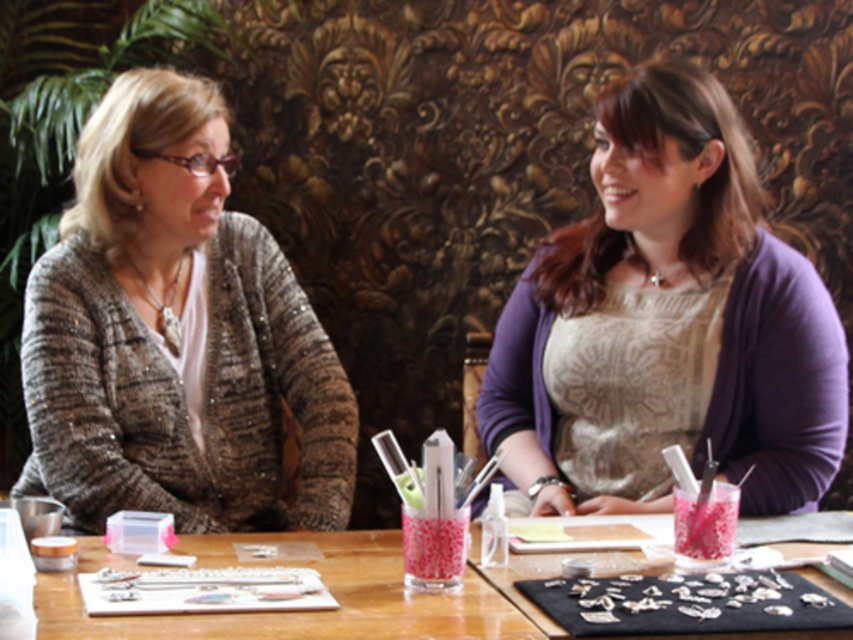
Between point (247, 275) and point (227, 545), which one is positioned behind?

The point (247, 275) is behind.

Image resolution: width=853 pixels, height=640 pixels. Describe the element at coordinates (173, 336) in the screenshot. I see `sparkly gray cardigan at left` at that location.

What are the coordinates of `sparkly gray cardigan at left` in the screenshot? It's located at (173, 336).

Locate an element on the screen. purple textured sweater at center is located at coordinates (666, 321).

Is point (584, 474) less distant than point (117, 225)?

No, (584, 474) is further to viewer.

Image resolution: width=853 pixels, height=640 pixels. I want to click on purple textured sweater at center, so click(x=666, y=321).

Is purple textured sweater at center to the left of wooden table at center from the viewer's perspective?

No, purple textured sweater at center is not to the left of wooden table at center.

Looking at this image, can you confirm if purple textured sweater at center is bigger than wooden table at center?

Correct, purple textured sweater at center is larger in size than wooden table at center.

Locate an element on the screen. purple textured sweater at center is located at coordinates (666, 321).